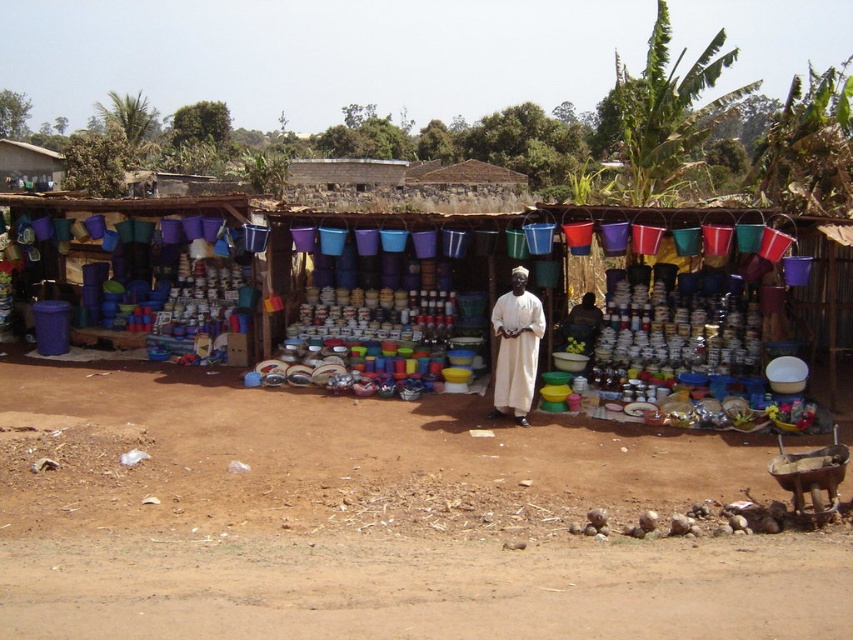
You are a customer at the market and want to place a heavy item on the ground near the stall. The vendor points to the brown dirt field at lower center as the spot. Based on the coordinates given, can you confirm if this location is suitable for placing a heavy item?

The brown dirt field at lower center is located at coordinates point (375, 520), so yes, this is the correct spot to place the heavy item as indicated by the vendor.

You are a customer at the market stall and want to pick up an item from the multicolored plastic buckets at center. However, there is a brown dirt field at lower center between you and the buckets. Can you reach the buckets without stepping on the dirt field?

The brown dirt field at lower center and multicolored plastic buckets at center are 26.22 feet apart. Since the distance is quite large, you would need to walk around or find another path to avoid stepping on the dirt field.